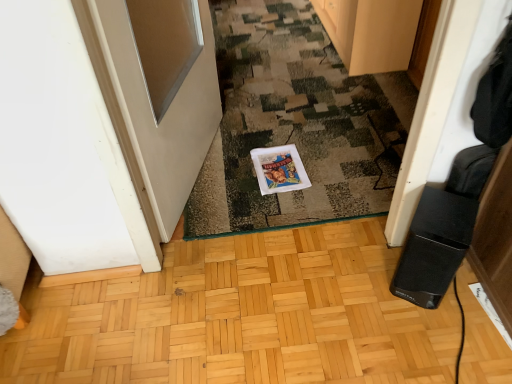
Question: Is the depth of wooden cabinet at upper center less than that of camouflage carpet at center?

Choices:
 (A) yes
 (B) no

Answer: (B)

Question: Is wooden cabinet at upper center thinner than camouflage carpet at center?

Choices:
 (A) no
 (B) yes

Answer: (B)

Question: Can you confirm if wooden cabinet at upper center is positioned to the left of camouflage carpet at center?

Choices:
 (A) no
 (B) yes

Answer: (A)

Question: Considering the relative positions of wooden cabinet at upper center and camouflage carpet at center in the image provided, is wooden cabinet at upper center behind camouflage carpet at center?

Choices:
 (A) yes
 (B) no

Answer: (A)

Question: Is wooden cabinet at upper center not inside camouflage carpet at center?

Choices:
 (A) yes
 (B) no

Answer: (A)

Question: Is wooden cabinet at upper center in front of or behind white glossy door at left in the image?

Choices:
 (A) behind
 (B) front

Answer: (A)

Question: From the image's perspective, is wooden cabinet at upper center positioned above or below white glossy door at left?

Choices:
 (A) above
 (B) below

Answer: (A)

Question: Considering the positions of point (343, 6) and point (218, 84), is point (343, 6) closer or farther from the camera than point (218, 84)?

Choices:
 (A) farther
 (B) closer

Answer: (A)

Question: From a real-world perspective, is wooden cabinet at upper center positioned above or below white glossy door at left?

Choices:
 (A) below
 (B) above

Answer: (A)

Question: From the image's perspective, is black plastic speaker at lower right located above or below camouflage carpet at center?

Choices:
 (A) above
 (B) below

Answer: (B)

Question: Based on their sizes in the image, would you say black plastic speaker at lower right is bigger or smaller than camouflage carpet at center?

Choices:
 (A) small
 (B) big

Answer: (A)

Question: Is point (428, 266) positioned closer to the camera than point (406, 117)?

Choices:
 (A) closer
 (B) farther

Answer: (A)

Question: In the image, is black plastic speaker at lower right on the left side or the right side of camouflage carpet at center?

Choices:
 (A) right
 (B) left

Answer: (A)

Question: In terms of width, does white glossy postcard at center look wider or thinner when compared to white glossy door at left?

Choices:
 (A) wide
 (B) thin

Answer: (A)

Question: Considering the relative positions of white glossy postcard at center and white glossy door at left in the image provided, is white glossy postcard at center to the left or to the right of white glossy door at left?

Choices:
 (A) right
 (B) left

Answer: (A)